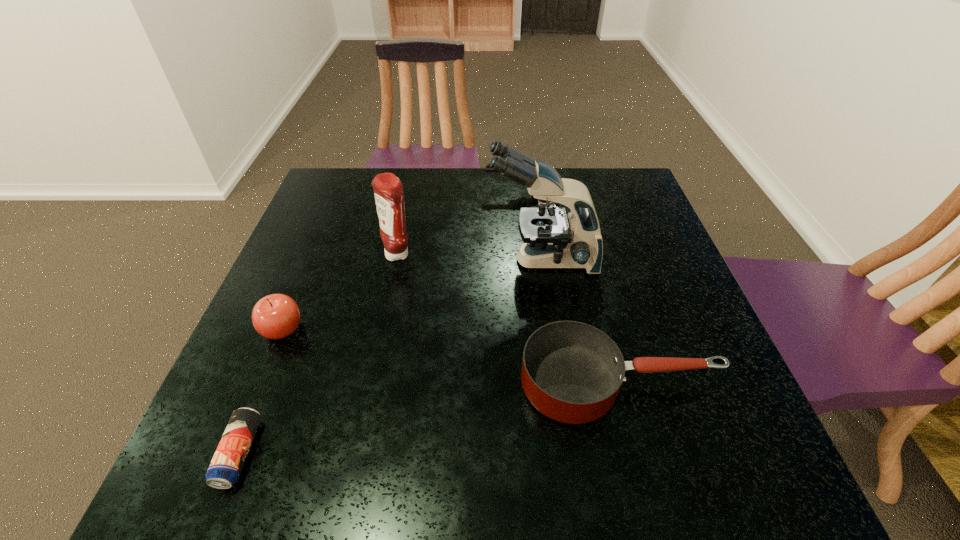
Identify the location of free spot located 0.240m on the left of the second tallest object. The height and width of the screenshot is (540, 960). (288, 254).

This screenshot has width=960, height=540. Find the location of `vacant area located on the back of the apple`. vacant area located on the back of the apple is located at coordinates (301, 284).

Identify the location of vacant space located 0.300m at the end of the barrel of the farthest object. (385, 192).

I want to click on vacant space located 0.090m at the end of the barrel of the farthest object, so click(455, 192).

The width and height of the screenshot is (960, 540). In order to click on vacant region located 0.220m at the end of the barrel of the farthest object in this screenshot , I will do `click(412, 192)`.

Where is `free space located on the back of the shortest object`? free space located on the back of the shortest object is located at coordinates (297, 311).

I want to click on object present at the far edge, so click(488, 169).

At what (x,y) coordinates should I click in order to perform the action: click on object that is at the near edge. Please return your answer as a coordinate pair (x, y). This screenshot has height=540, width=960. Looking at the image, I should click on (224, 470).

Find the location of a particular element. apple present at the left edge is located at coordinates (276, 316).

Find the location of `beer can situated at the left edge`. beer can situated at the left edge is located at coordinates (224, 470).